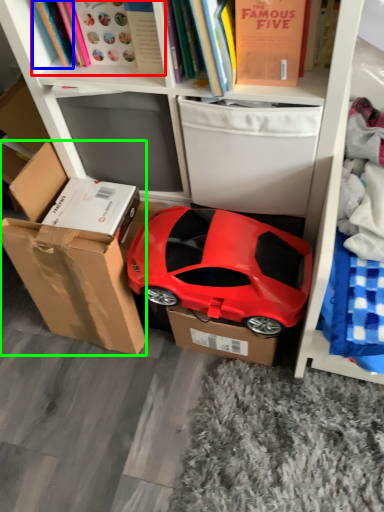
Question: Which object is the closest to the book (highlighted by a red box)? Choose among these: book (highlighted by a blue box) or box (highlighted by a green box).

Choices:
 (A) book
 (B) box

Answer: (A)